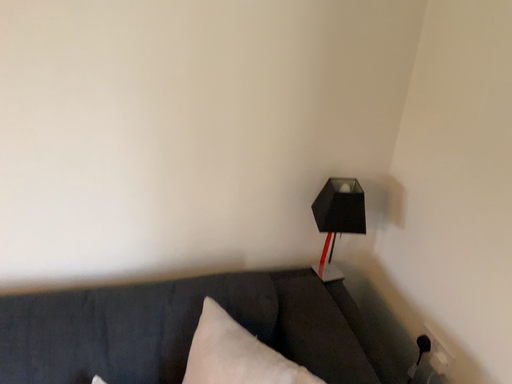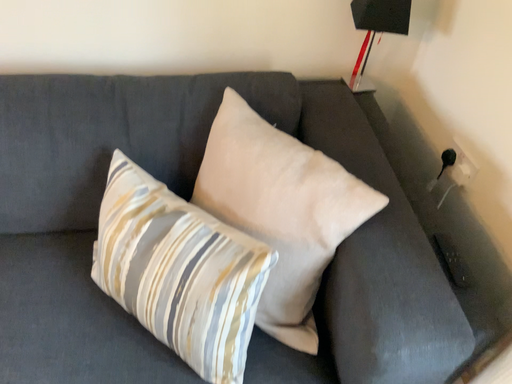
Question: How did the camera likely rotate when shooting the video?

Choices:
 (A) rotated downward
 (B) rotated upward

Answer: (A)